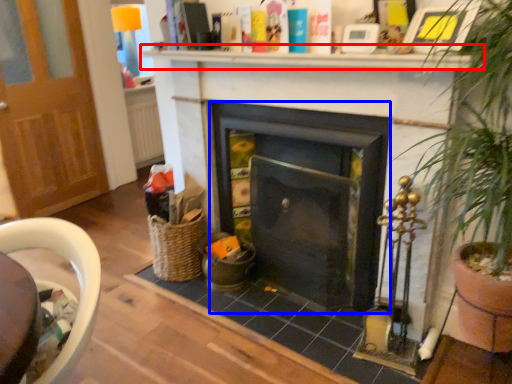
Question: Which object appears closest to the camera in this image, mantle (highlighted by a red box) or fireplace (highlighted by a blue box)?

Choices:
 (A) mantle
 (B) fireplace

Answer: (A)